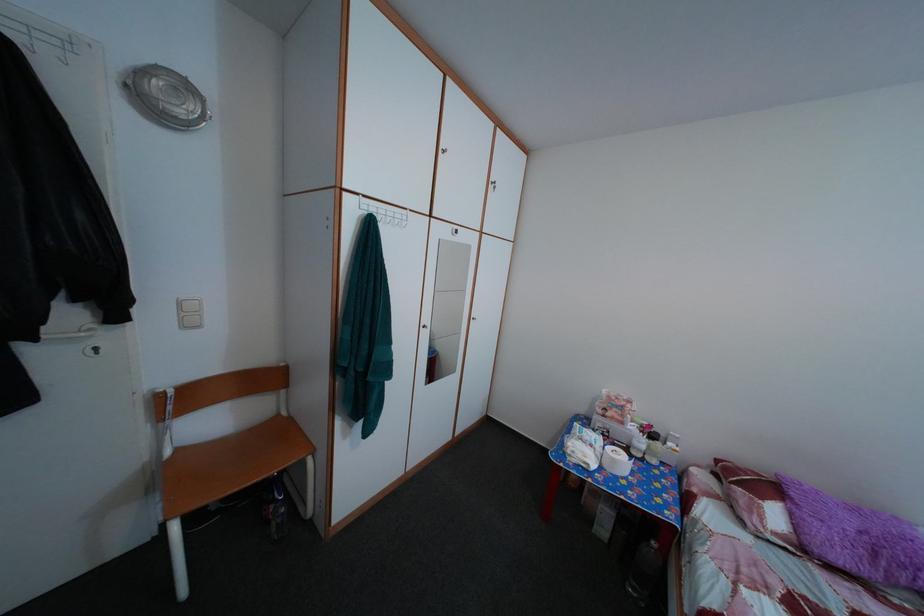
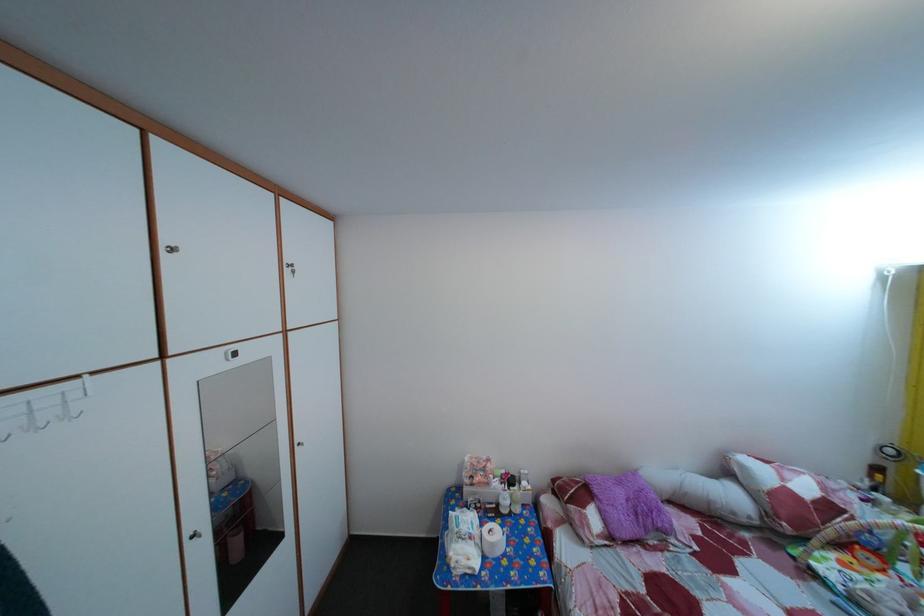
In the second image, find the point that corresponds to [864,517] in the first image.

(629, 491)